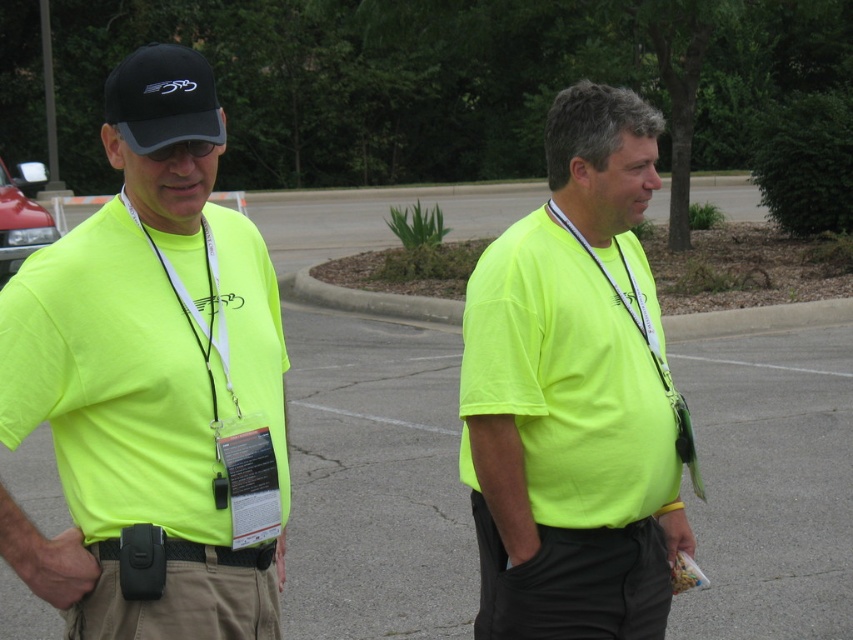
Question: Which of the following is the farthest from the observer?

Choices:
 (A) neon yellow t-shirt at center
 (B) black fabric baseball cap at upper left
 (C) khaki cotton pants at center
 (D) neon yellow t-shirt at left

Answer: (A)

Question: Which object is the closest to the khaki cotton pants at center?

Choices:
 (A) neon yellow t-shirt at left
 (B) black fabric baseball cap at upper left
 (C) neon yellow t-shirt at center

Answer: (A)

Question: Does neon yellow t-shirt at center have a larger size compared to black fabric baseball cap at upper left?

Choices:
 (A) no
 (B) yes

Answer: (B)

Question: Can you confirm if khaki cotton pants at center is wider than black fabric baseball cap at upper left?

Choices:
 (A) no
 (B) yes

Answer: (A)

Question: Can you confirm if neon yellow t-shirt at center is positioned below black fabric baseball cap at upper left?

Choices:
 (A) no
 (B) yes

Answer: (B)

Question: Among these points, which one is farthest from the camera?

Choices:
 (A) (209, 134)
 (B) (210, 481)

Answer: (B)